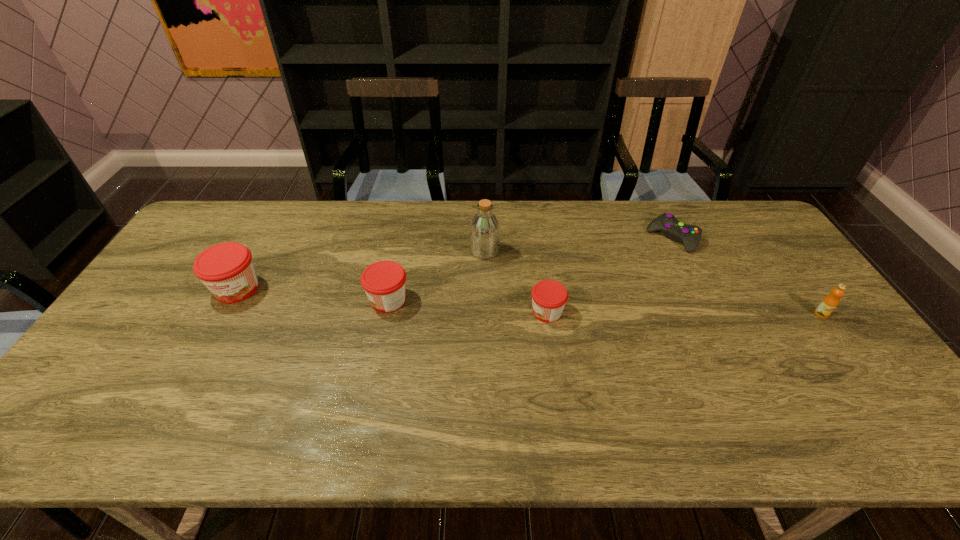
Find the location of `unoccupied position between the leftmost jam and the bottle`. unoccupied position between the leftmost jam and the bottle is located at coordinates (361, 270).

Find the location of a particular element. The image size is (960, 540). free point between the leftmost object and the third object from left to right is located at coordinates (361, 270).

The width and height of the screenshot is (960, 540). Find the location of `free area in between the second shortest object and the second object from left to right`. free area in between the second shortest object and the second object from left to right is located at coordinates (468, 306).

Locate an element on the screen. Image resolution: width=960 pixels, height=540 pixels. blank region between the shortest object and the shortest jam is located at coordinates (610, 275).

Locate an element on the screen. The image size is (960, 540). free area in between the second shortest object and the fifth object from left to right is located at coordinates (610, 275).

This screenshot has height=540, width=960. I want to click on vacant space in between the second shortest jam and the third object from left to right, so click(437, 275).

Identify the location of free point between the bottle and the second object from right to left. The width and height of the screenshot is (960, 540). (579, 245).

The height and width of the screenshot is (540, 960). Find the location of `free space between the second shortest jam and the bottle`. free space between the second shortest jam and the bottle is located at coordinates click(437, 275).

Locate an element on the screen. unoccupied position between the tallest object and the tallest jam is located at coordinates (361, 270).

Locate an element on the screen. This screenshot has height=540, width=960. object that is the fifth closest one to the second jam from left to right is located at coordinates (829, 303).